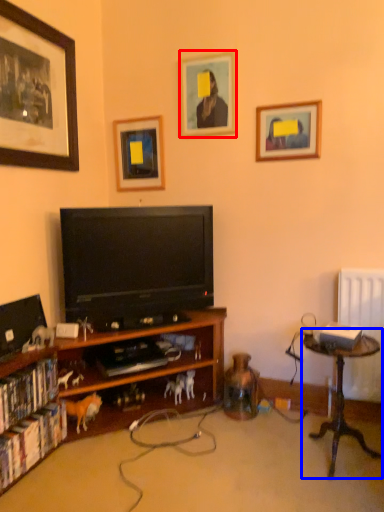
Question: Which point is further to the camera, picture frame (highlighted by a red box) or table (highlighted by a blue box)?

Choices:
 (A) picture frame
 (B) table

Answer: (A)